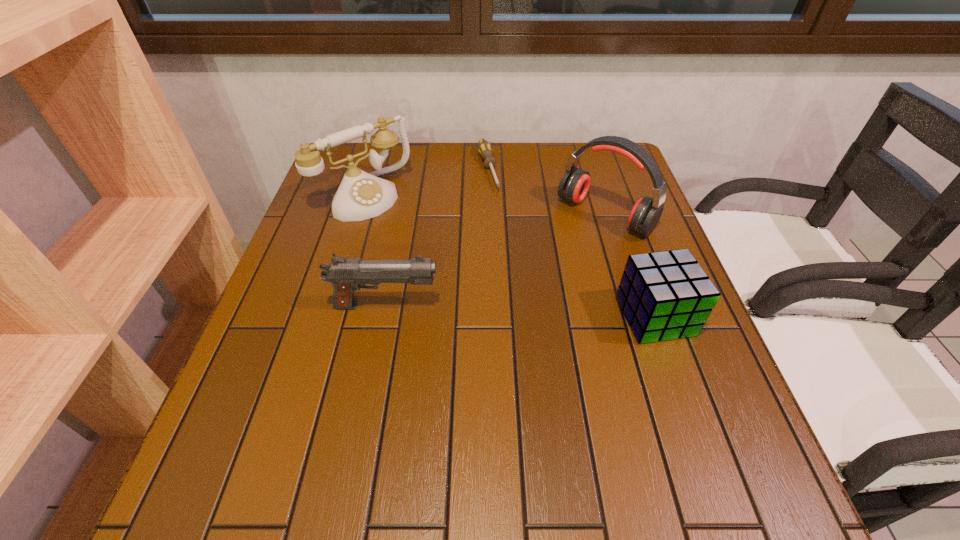
Where is `vacant area that lies between the shortest object and the cube`? The width and height of the screenshot is (960, 540). vacant area that lies between the shortest object and the cube is located at coordinates (571, 242).

What are the coordinates of `vacant point located between the gun and the telephone` in the screenshot? It's located at (375, 251).

This screenshot has height=540, width=960. I want to click on vacant space that is in between the screwdriver and the gun, so point(437,238).

In order to click on blank region between the gun and the screwdriver in this screenshot , I will do `click(437, 238)`.

Image resolution: width=960 pixels, height=540 pixels. I want to click on free area in between the cube and the third object from left to right, so click(x=571, y=242).

This screenshot has width=960, height=540. I want to click on vacant space that's between the cube and the telephone, so click(510, 256).

Locate which object ranks second in proximity to the cube. Please provide its 2D coordinates. Your answer should be formatted as a tuple, i.e. [(x, y)], where the tuple contains the x and y coordinates of a point satisfying the conditions above.

[(346, 274)]

Select which object is the third closest to the shortest object. Please provide its 2D coordinates. Your answer should be formatted as a tuple, i.e. [(x, y)], where the tuple contains the x and y coordinates of a point satisfying the conditions above.

[(346, 274)]

Locate an element on the screen. The height and width of the screenshot is (540, 960). vacant space that satisfies the following two spatial constraints: 1. on the back side of the telephone; 2. on the right side of the shortest object is located at coordinates (372, 169).

Identify the location of free point that satisfies the following two spatial constraints: 1. on the front side of the telephone; 2. on the left side of the earphone. The height and width of the screenshot is (540, 960). (358, 215).